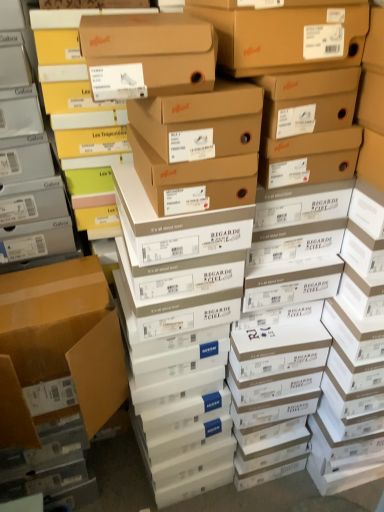
I want to click on blank space situated above matte cardboard box at left (from a real-world perspective), so click(57, 293).